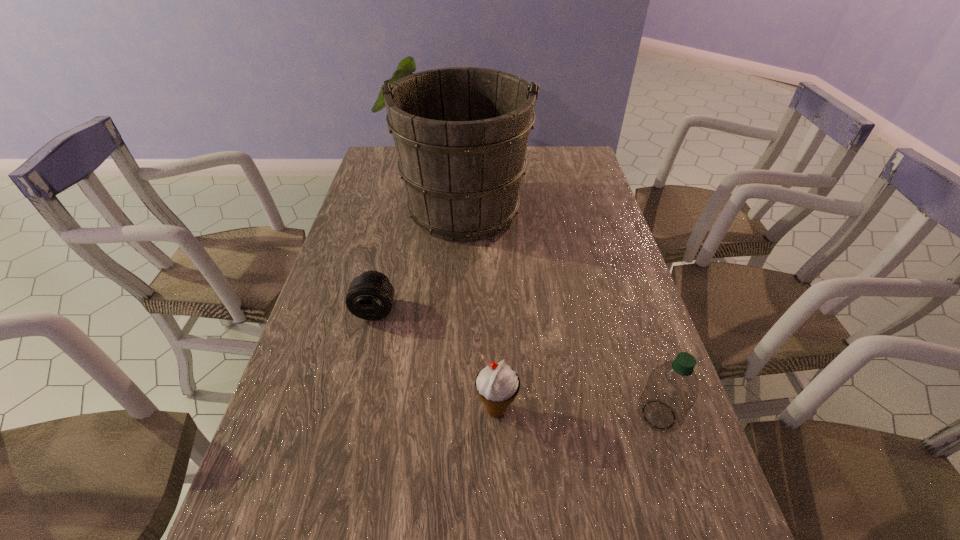
The image size is (960, 540). I want to click on bucket, so click(x=461, y=133).

You are a GUI agent. You are given a task and a screenshot of the screen. Output one action in this format:
    pyautogui.click(x=<x>, y=<y>)
    Task: Click on the tallest object
    
    Given the screenshot: What is the action you would take?
    pyautogui.click(x=461, y=133)

At what (x,y) coordinates should I click in order to perform the action: click on water bottle. Please return your answer as a coordinate pair (x, y). This screenshot has width=960, height=540. Looking at the image, I should click on (672, 389).

Locate an element on the screen. This screenshot has height=540, width=960. the second tallest object is located at coordinates (672, 389).

Where is `icecream`? icecream is located at coordinates (497, 384).

I want to click on telephoto lens, so click(x=370, y=296).

Locate an element on the screen. The height and width of the screenshot is (540, 960). the second farthest object is located at coordinates (370, 296).

The width and height of the screenshot is (960, 540). I want to click on free point located 0.180m on the handle side of the farthest object, so (467, 150).

Locate an element on the screen. This screenshot has width=960, height=540. free space located on the front of the third shortest object is located at coordinates (673, 460).

Find the location of a particular element. This screenshot has height=540, width=960. free space located 0.270m on the left of the third tallest object is located at coordinates (351, 410).